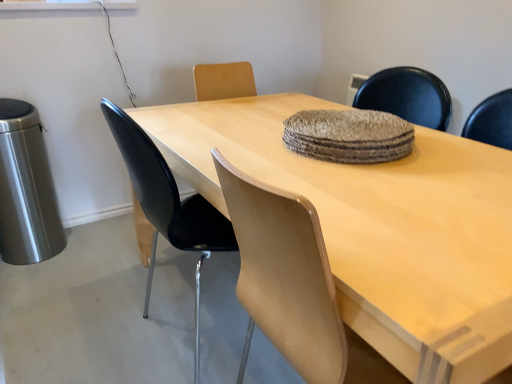
Question: Is black plastic chair at left placed right next to light wood table at center?

Choices:
 (A) no
 (B) yes

Answer: (A)

Question: Is black plastic chair at left not near light wood table at center?

Choices:
 (A) no
 (B) yes

Answer: (A)

Question: Could you tell me if black plastic chair at left is facing light wood table at center?

Choices:
 (A) yes
 (B) no

Answer: (A)

Question: Is black plastic chair at left bigger than light wood table at center?

Choices:
 (A) yes
 (B) no

Answer: (B)

Question: From the image's perspective, is black plastic chair at left under light wood table at center?

Choices:
 (A) yes
 (B) no

Answer: (B)

Question: Is point 195,170 closer or farther from the camera than point 353,150?

Choices:
 (A) closer
 (B) farther

Answer: (B)

Question: Would you say light wood table at center is to the left or to the right of textured woven mat at center in the picture?

Choices:
 (A) left
 (B) right

Answer: (A)

Question: Considering the positions of light wood table at center and textured woven mat at center in the image, is light wood table at center bigger or smaller than textured woven mat at center?

Choices:
 (A) small
 (B) big

Answer: (B)

Question: Is light wood table at center inside or outside of textured woven mat at center?

Choices:
 (A) outside
 (B) inside

Answer: (A)

Question: Based on their positions, is black plastic chair at left located to the left or right of textured woven mat at center?

Choices:
 (A) left
 (B) right

Answer: (A)

Question: From their relative heights in the image, would you say black plastic chair at left is taller or shorter than textured woven mat at center?

Choices:
 (A) short
 (B) tall

Answer: (B)

Question: Is black plastic chair at left inside the boundaries of textured woven mat at center, or outside?

Choices:
 (A) inside
 (B) outside

Answer: (B)

Question: Is black plastic chair at left bigger or smaller than textured woven mat at center?

Choices:
 (A) big
 (B) small

Answer: (A)

Question: Would you say textured woven mat at center is inside or outside light wood table at center?

Choices:
 (A) inside
 (B) outside

Answer: (B)

Question: In terms of width, does textured woven mat at center look wider or thinner when compared to light wood table at center?

Choices:
 (A) wide
 (B) thin

Answer: (B)